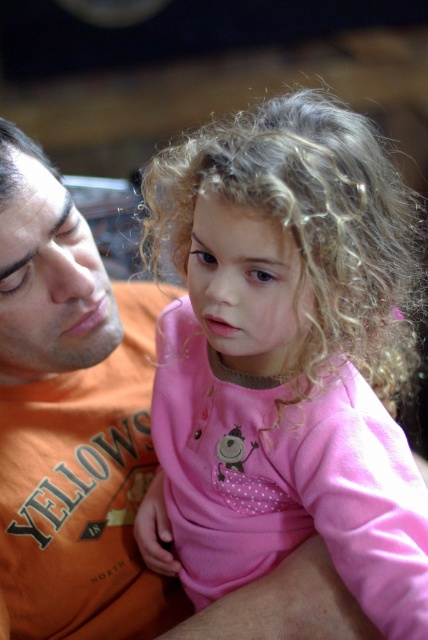
You are a photographer adjusting your camera settings. You notice the pink fabric at center and the orange cotton shirt at left in your viewfinder. Which object should you focus on if you want to prioritize the subject on the right side of the frame?

The pink fabric at center is to the right of the orange cotton shirt at left, so you should focus on the pink fabric at center to prioritize the subject on the right side of the frame.

You are a photographer adjusting the lighting in this scene. You notice the pink fabric at center and orange cotton shirt at left. Which object should you focus on to ensure the subject in front is properly lit?

The pink fabric at center should be focused on because it is in front of the orange cotton shirt at left, making it the closer subject to the camera.